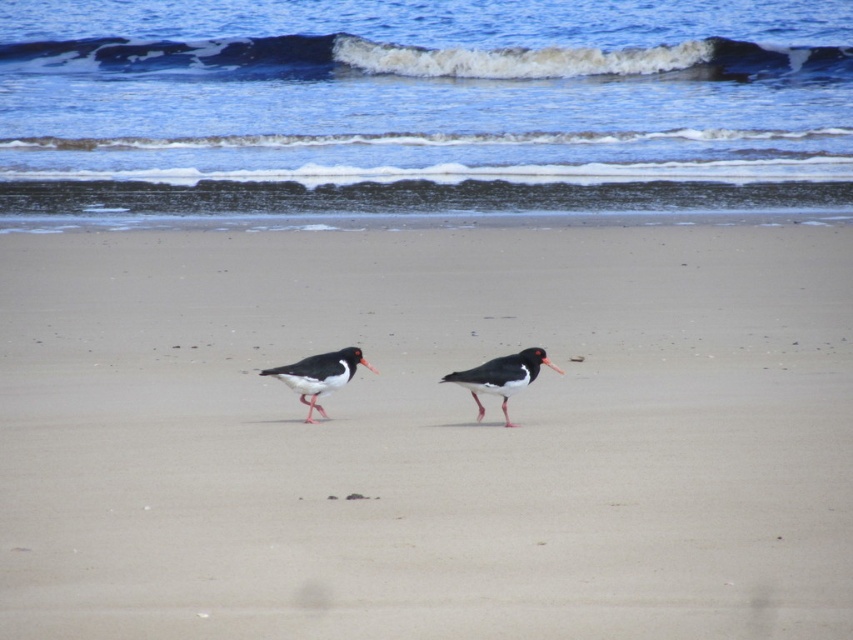
Question: Where is smooth sand at center located in relation to black glossy oystercatcher at center in the image?

Choices:
 (A) below
 (B) above

Answer: (B)

Question: Which of the following is the closest to the observer?

Choices:
 (A) (492, 369)
 (B) (537, 275)
 (C) (302, 365)

Answer: (A)

Question: Which point is farther to the camera?

Choices:
 (A) black matte bird at center
 (B) smooth sand at center

Answer: (A)

Question: Can you confirm if black matte bird at center is positioned to the right of black glossy oystercatcher at center?

Choices:
 (A) no
 (B) yes

Answer: (B)

Question: Which of the following is the farthest from the observer?

Choices:
 (A) (352, 362)
 (B) (454, 376)
 (C) (502, 276)

Answer: (C)

Question: Is the position of smooth sand at center less distant than that of black glossy oystercatcher at center?

Choices:
 (A) no
 (B) yes

Answer: (B)